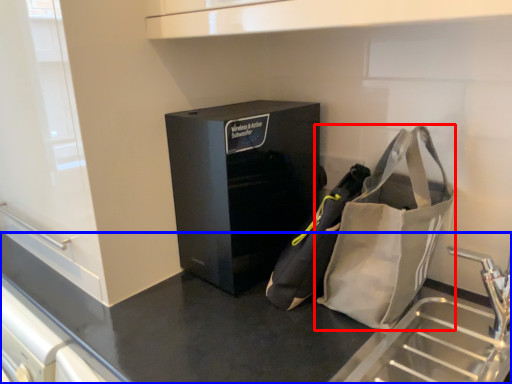
Question: Among these objects, which one is nearest to the camera, handbag (highlighted by a red box) or counter (highlighted by a blue box)?

Choices:
 (A) handbag
 (B) counter

Answer: (B)